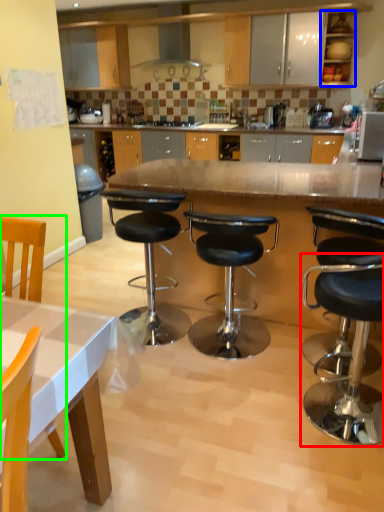
Question: Which object is the closest to the stool (highlighted by a red box)? Choose among these: cabinetry (highlighted by a blue box) or chair (highlighted by a green box).

Choices:
 (A) cabinetry
 (B) chair

Answer: (B)